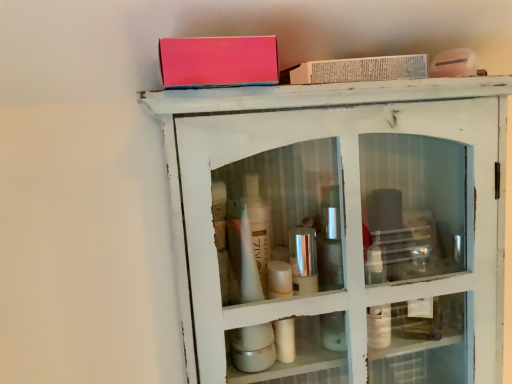
Question: Does white distressed cabinet at upper center have a greater width compared to matte pink box at upper center, marked as the first book in a left-to-right arrangement?

Choices:
 (A) no
 (B) yes

Answer: (B)

Question: Is the position of white distressed cabinet at upper center more distant than that of matte pink box at upper center, positioned as the first book in front-to-back order?

Choices:
 (A) no
 (B) yes

Answer: (B)

Question: Is white distressed cabinet at upper center thinner than matte pink box at upper center, which is the 2th book in back-to-front order?

Choices:
 (A) no
 (B) yes

Answer: (A)

Question: From the image's perspective, is white distressed cabinet at upper center above matte pink box at upper center, positioned as the first book in front-to-back order?

Choices:
 (A) yes
 (B) no

Answer: (B)

Question: Does white distressed cabinet at upper center have a larger size compared to matte pink box at upper center, the 2th book viewed from the right?

Choices:
 (A) no
 (B) yes

Answer: (B)

Question: Would you say white paper book at upper center, positioned as the 2th book in front-to-back order, is inside or outside matte pink box at upper center, the 2th book viewed from the right?

Choices:
 (A) outside
 (B) inside

Answer: (A)

Question: Considering the positions of white paper book at upper center, the 1th book positioned from the right, and matte pink box at upper center, marked as the first book in a left-to-right arrangement, in the image, is white paper book at upper center, the 1th book positioned from the right, taller or shorter than matte pink box at upper center, marked as the first book in a left-to-right arrangement,?

Choices:
 (A) tall
 (B) short

Answer: (B)

Question: From the image's perspective, is white paper book at upper center, the 1th book positioned from the right, located above or below matte pink box at upper center, marked as the first book in a left-to-right arrangement?

Choices:
 (A) below
 (B) above

Answer: (B)

Question: From a real-world perspective, is white paper book at upper center, the 1th book positioned from the right, physically located above or below matte pink box at upper center, marked as the first book in a left-to-right arrangement?

Choices:
 (A) below
 (B) above

Answer: (B)

Question: Looking at the image, does matte pink box at upper center, the 2th book viewed from the right, seem bigger or smaller compared to white paper book at upper center, positioned as the 2th book in front-to-back order?

Choices:
 (A) big
 (B) small

Answer: (A)

Question: From the image's perspective, is matte pink box at upper center, which is the 2th book in back-to-front order, above or below white paper book at upper center, the 1th book viewed from the back?

Choices:
 (A) below
 (B) above

Answer: (A)

Question: From a real-world perspective, is matte pink box at upper center, marked as the first book in a left-to-right arrangement, positioned above or below white paper book at upper center, the 1th book positioned from the right?

Choices:
 (A) below
 (B) above

Answer: (A)

Question: Is matte pink box at upper center, marked as the first book in a left-to-right arrangement, wider or thinner than white paper book at upper center, positioned as the 2th book in front-to-back order?

Choices:
 (A) thin
 (B) wide

Answer: (B)

Question: From a real-world perspective, is matte pink box at upper center, the 2th book viewed from the right, positioned above or below white distressed cabinet at upper center?

Choices:
 (A) above
 (B) below

Answer: (A)

Question: Is matte pink box at upper center, the 2th book viewed from the right, taller or shorter than white distressed cabinet at upper center?

Choices:
 (A) tall
 (B) short

Answer: (B)